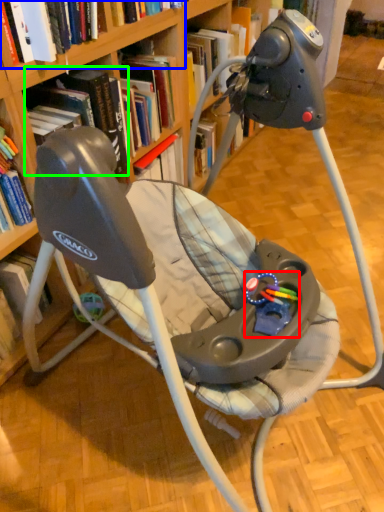
Question: Which is farther away from toy (highlighted by a red box)? book (highlighted by a blue box) or book (highlighted by a green box)?

Choices:
 (A) book
 (B) book

Answer: (A)